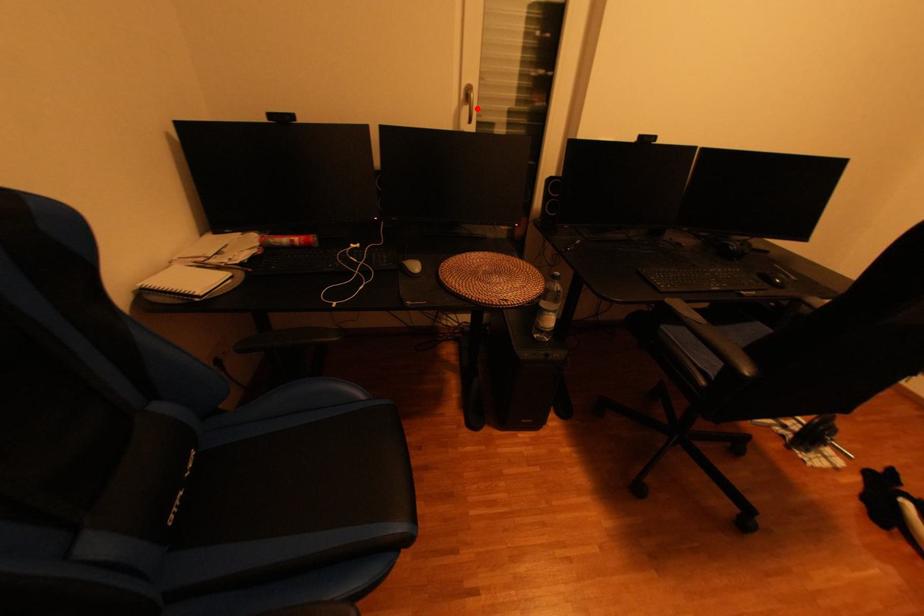
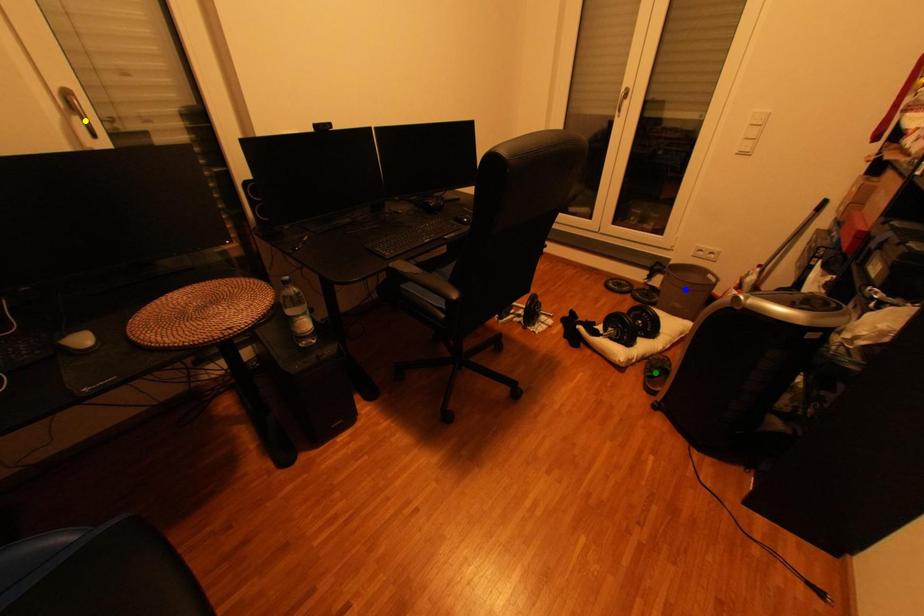
Question: I am providing you with two images of the same scene from different viewpoints. A red point is marked on the first image. You are given multiple points on the second image. In image 2, which mark is for the same physical point as the one in image 1?

Choices:
 (A) green point
 (B) blue point
 (C) yellow point

Answer: (C)